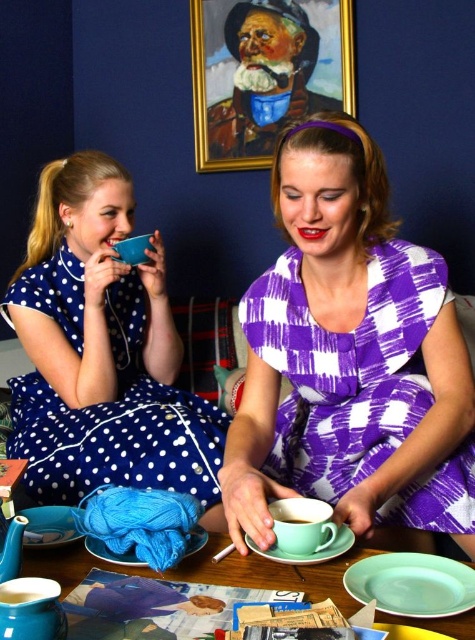
Question: Does green matte plate at lower right have a larger size compared to matte ceramic cup at center?

Choices:
 (A) no
 (B) yes

Answer: (B)

Question: Which object appears closest to the camera in this image?

Choices:
 (A) matte blue teapot at lower left
 (B) green matte plate at lower right
 (C) purple checkered dress at center
 (D) matte green saucer at lower center

Answer: (B)

Question: Can you confirm if matte green saucer at lower center is positioned to the left of blue fabric at lower center?

Choices:
 (A) yes
 (B) no

Answer: (B)

Question: Which object is the closest to the green matte plate at lower right?

Choices:
 (A) matte ceramic table at center
 (B) matte ceramic teacup at lower center
 (C) matte blue teapot at lower left
 (D) white dotted fabric dress at left

Answer: (A)

Question: Among these points, which one is farthest from the camera?

Choices:
 (A) (296, 518)
 (B) (300, 588)
 (C) (115, 563)
 (D) (40, 516)

Answer: (D)

Question: Is purple checkered dress at center wider than matte blue teapot at lower left?

Choices:
 (A) no
 (B) yes

Answer: (B)